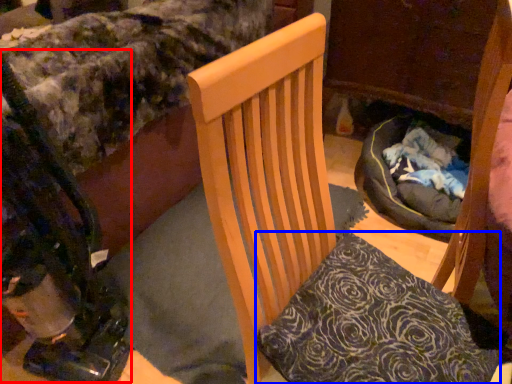
Question: Which point is closer to the camera, baby carriage (highlighted by a red box) or pillow (highlighted by a blue box)?

Choices:
 (A) baby carriage
 (B) pillow

Answer: (A)